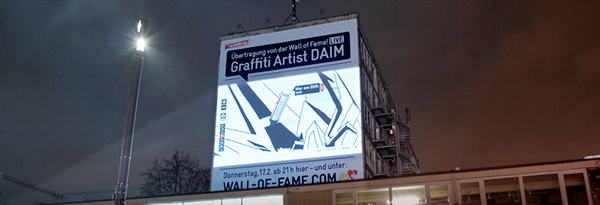
At what (x,y) coordinates should I click in order to perform the action: click on light. Please return your answer as a coordinate pair (x, y). Looking at the image, I should click on (138, 43).